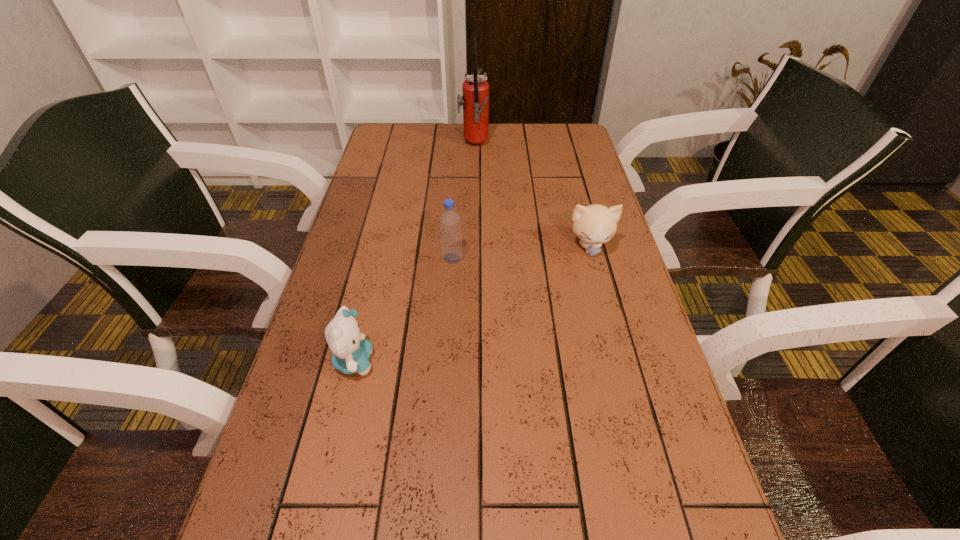
Where is `free region that satisfies the following two spatial constraints: 1. at the nozzle of the tallest object; 2. on the front side of the bottle`? This screenshot has width=960, height=540. free region that satisfies the following two spatial constraints: 1. at the nozzle of the tallest object; 2. on the front side of the bottle is located at coordinates (471, 258).

Locate an element on the screen. free region that satisfies the following two spatial constraints: 1. on the face of the right kitten; 2. on the face of the leftmost object is located at coordinates (620, 362).